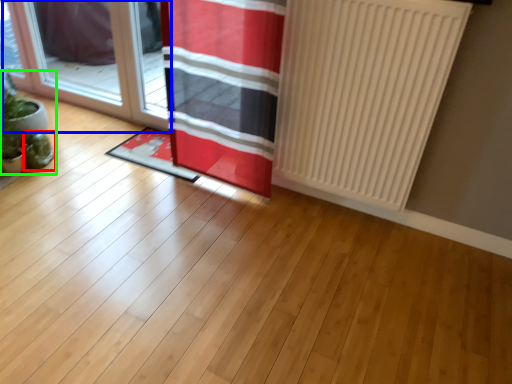
Question: Which is farther away from plant (highlighted by a red box)? door (highlighted by a blue box) or houseplant (highlighted by a green box)?

Choices:
 (A) door
 (B) houseplant

Answer: (A)